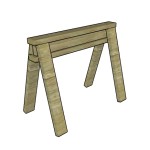
Locate an element on the screen. stand is located at coordinates (86, 41).